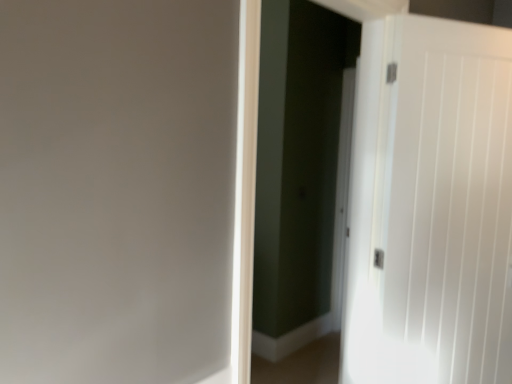
Question: Considering the relative sizes of white smooth door at right and white glossy screen door at center in the image provided, is white smooth door at right bigger than white glossy screen door at center?

Choices:
 (A) no
 (B) yes

Answer: (A)

Question: Considering the relative positions of white smooth door at right and white glossy screen door at center in the image provided, is white smooth door at right behind white glossy screen door at center?

Choices:
 (A) no
 (B) yes

Answer: (B)

Question: Is white smooth door at right to the right of white glossy screen door at center from the viewer's perspective?

Choices:
 (A) no
 (B) yes

Answer: (B)

Question: Is white smooth door at right facing away from white glossy screen door at center?

Choices:
 (A) yes
 (B) no

Answer: (B)

Question: Does white smooth door at right have a smaller size compared to white glossy screen door at center?

Choices:
 (A) yes
 (B) no

Answer: (A)

Question: Is white smooth door at right oriented towards white glossy screen door at center?

Choices:
 (A) yes
 (B) no

Answer: (B)

Question: Considering the relative positions of white glossy screen door at center and white smooth door at right in the image provided, is white glossy screen door at center behind white smooth door at right?

Choices:
 (A) yes
 (B) no

Answer: (B)

Question: Is white glossy screen door at center located outside white smooth door at right?

Choices:
 (A) yes
 (B) no

Answer: (A)

Question: Does white glossy screen door at center have a lesser height compared to white smooth door at right?

Choices:
 (A) yes
 (B) no

Answer: (B)

Question: From a real-world perspective, is white glossy screen door at center beneath white smooth door at right?

Choices:
 (A) yes
 (B) no

Answer: (B)

Question: Is white glossy screen door at center aimed at white smooth door at right?

Choices:
 (A) no
 (B) yes

Answer: (A)

Question: Is white glossy screen door at center far away from white smooth door at right?

Choices:
 (A) no
 (B) yes

Answer: (B)

Question: Is white glossy screen door at center inside the boundaries of white smooth door at right, or outside?

Choices:
 (A) outside
 (B) inside

Answer: (A)